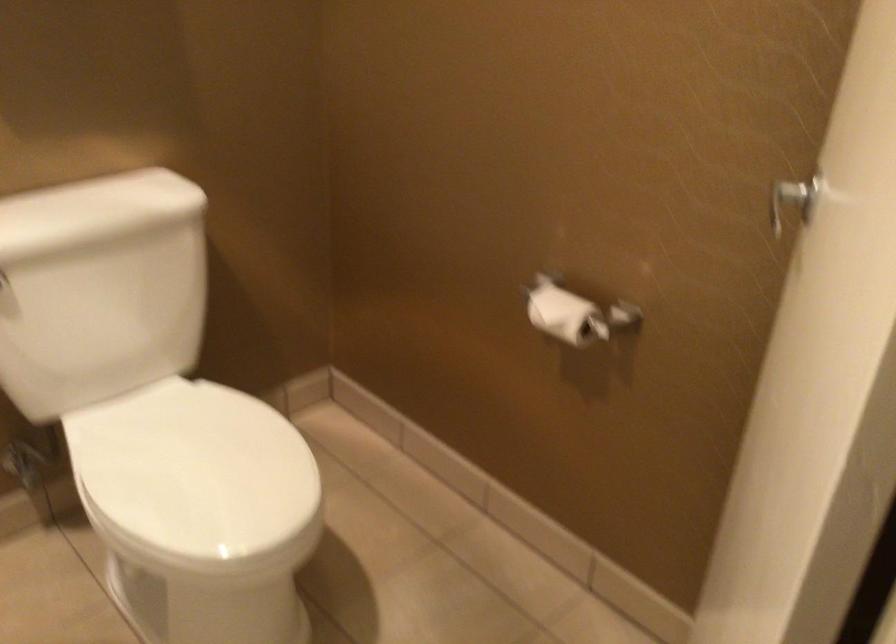
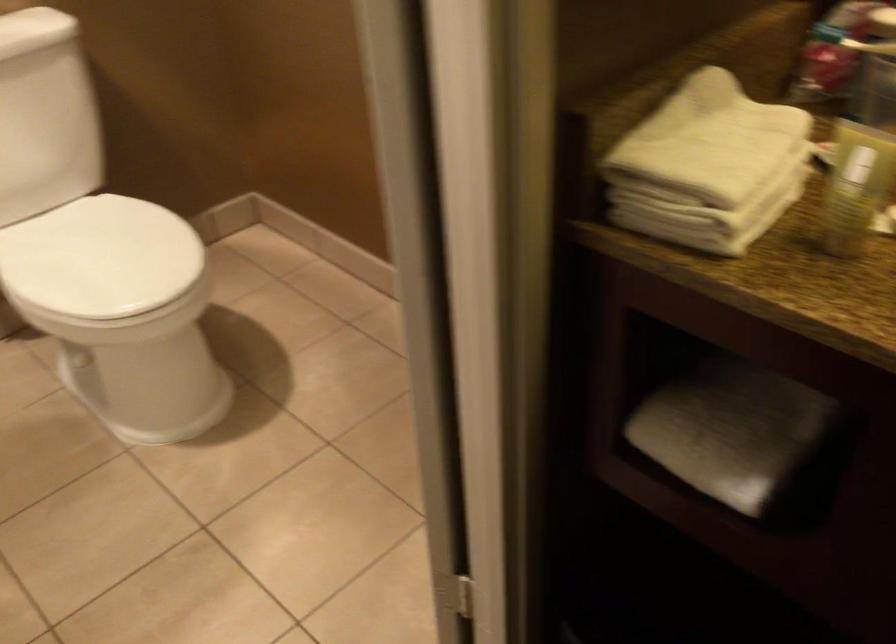
The images are taken continuously from a first-person perspective. In which direction are you moving?

The cameraman moved toward right, backward.